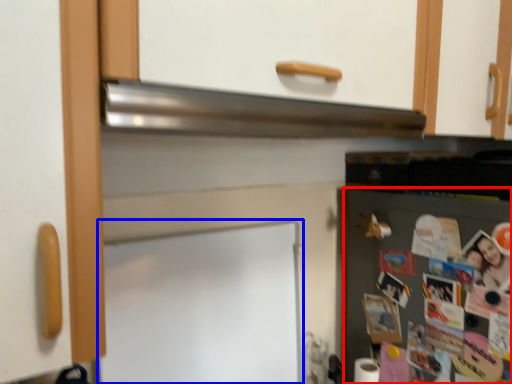
Question: Which of the following is the closest to the observer, fridge (highlighted by a red box) or bulletin board (highlighted by a blue box)?

Choices:
 (A) fridge
 (B) bulletin board

Answer: (B)